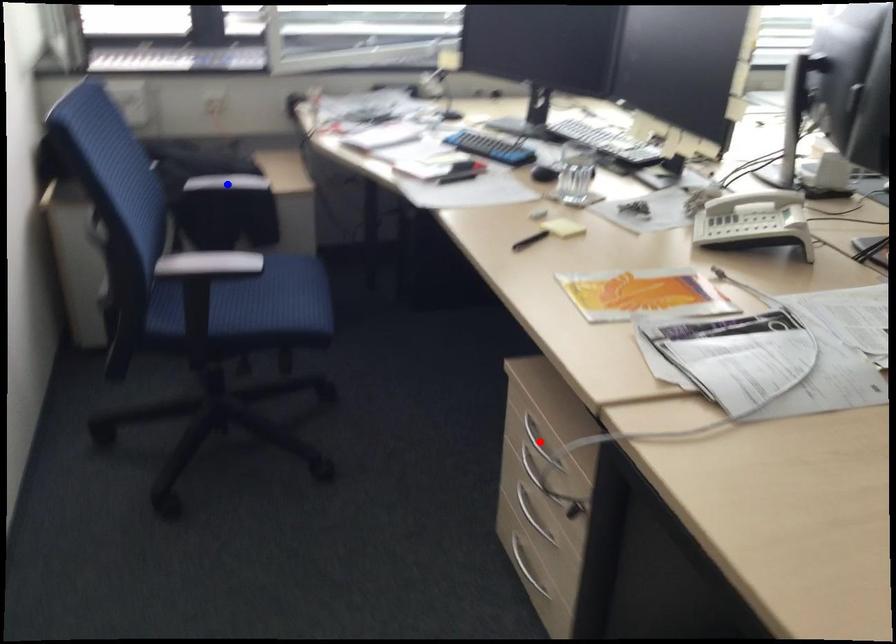
Question: Two points are marked on the image. Which point is closer to the camera?

Choices:
 (A) Blue point is closer.
 (B) Red point is closer.

Answer: (B)